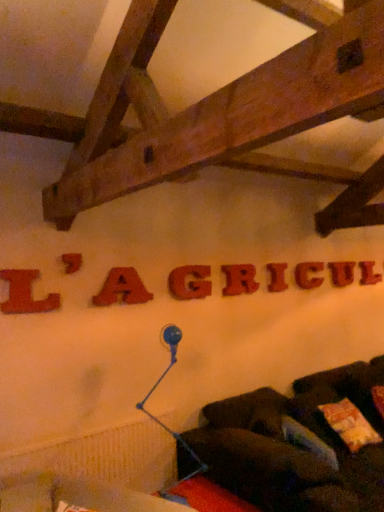
Question: Is matte red letter at center, the 6th letter in the front-to-back sequence, to the left or to the right of matte red letter at upper center, acting as the eighth letter starting from the back, in the image?

Choices:
 (A) right
 (B) left

Answer: (A)

Question: Is matte red letter at center, acting as the 4th letter starting from the back, inside the boundaries of matte red letter at upper center, arranged as the second letter when viewed from the front, or outside?

Choices:
 (A) inside
 (B) outside

Answer: (B)

Question: Estimate the real-world distances between objects in this image. Which object is farther from the matte red letter at upper center, the 8th letter viewed from the right?

Choices:
 (A) dark brown fabric couch at lower right
 (B) matte red letter at center, which is the sixth letter from left to right
 (C) matte red letter at left, which is the 1th letter from left to right
 (D) blue glass lamp at lower center
 (E) red matte letter g at center, the sixth letter viewed from the right

Answer: (A)

Question: Estimate the real-world distances between objects in this image. Which object is closer to the matte red letter at upper center, arranged as the second letter when viewed from the front?

Choices:
 (A) rubberized red letter r at center, which ranks as the 5th letter in back-to-front order
 (B) matte red letter at center, which is the sixth letter from left to right
 (C) red matte letter g at center, placed as the sixth letter when sorted from back to front
 (D) matte red letter at left, the ninth letter from the back
 (E) matte red letter at upper center, which appears as the eighth letter when viewed from the front

Answer: (D)